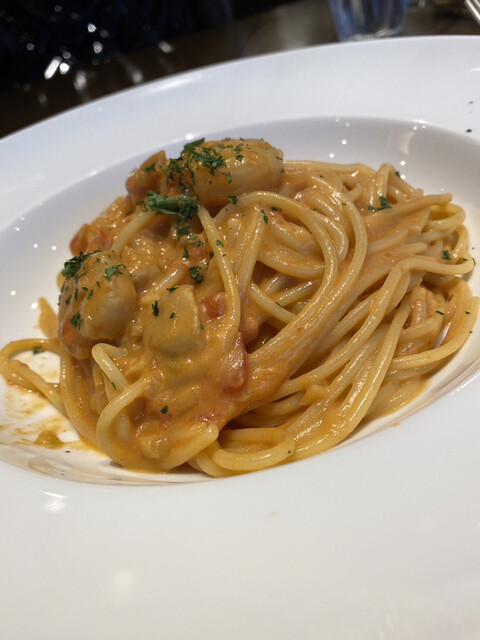
Where is `1 round plate`? 1 round plate is located at coordinates (417, 528).